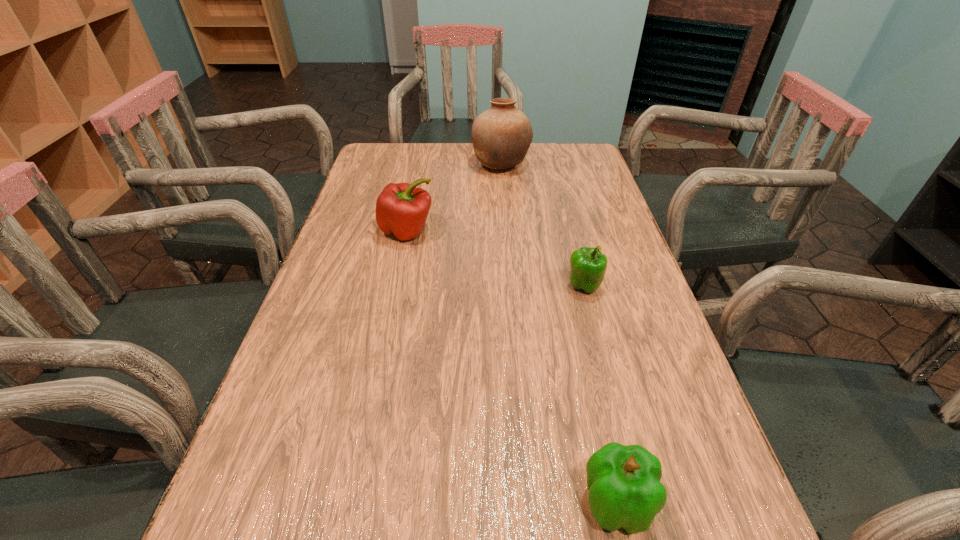
Locate which object ranks in proximity to the nearest object. Please provide its 2D coordinates. Your answer should be formatted as a tuple, i.e. [(x, y)], where the tuple contains the x and y coordinates of a point satisfying the conditions above.

[(588, 266)]

I want to click on bell pepper that is the second closest one to the nearest object, so click(x=401, y=209).

Locate an element on the screen. The width and height of the screenshot is (960, 540). bell pepper that is the second nearest to the second nearest object is located at coordinates (624, 485).

Where is `free spot that satisfies the following two spatial constraints: 1. on the back side of the farthest bell pepper; 2. on the right side of the farthest object`? Image resolution: width=960 pixels, height=540 pixels. free spot that satisfies the following two spatial constraints: 1. on the back side of the farthest bell pepper; 2. on the right side of the farthest object is located at coordinates (420, 165).

This screenshot has width=960, height=540. In order to click on free space that satisfies the following two spatial constraints: 1. on the front side of the second nearest bell pepper; 2. on the left side of the second farthest object in this screenshot , I will do `click(396, 286)`.